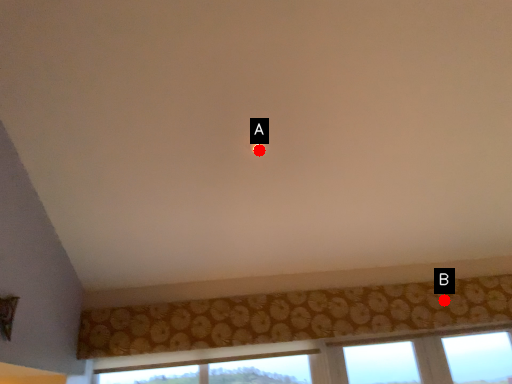
Question: Two points are circled on the image, labeled by A and B beside each circle. Which point appears farthest from the camera in this image?

Choices:
 (A) A is further
 (B) B is further

Answer: (B)